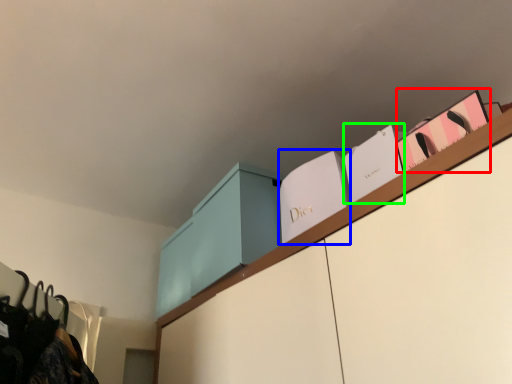
Question: Estimate the real-world distances between objects in this image. Which object is farther from book (highlighted by a red box), book (highlighted by a blue box) or book (highlighted by a green box)?

Choices:
 (A) book
 (B) book

Answer: (A)